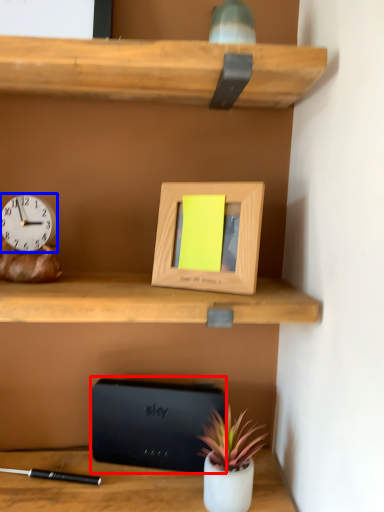
Question: Among these objects, which one is farthest to the camera, paperback book (highlighted by a red box) or clock (highlighted by a blue box)?

Choices:
 (A) paperback book
 (B) clock

Answer: (A)